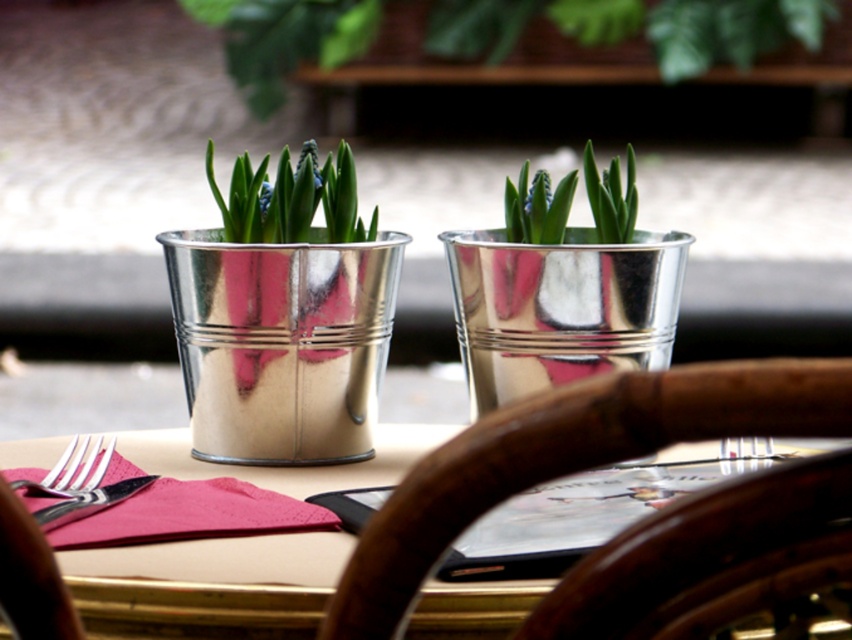
You are a server placing a silver metallic fork at left on the table. You need to place it exactly 10 centimeters away from the metallic silver pot at center. Is the current placement correct?

The metallic silver pot at center and silver metallic fork at left are currently 8.67 centimeters apart, which is less than the required 10 centimeters. The current placement is not correct.

You are sitting at the table and want to reach both points on the table surface. Which point, point (332, 188) or point (50, 472), is closer to you?

Point (332, 188) is further to the camera than point (50, 472), so the point closer to you is point (50, 472).

You are setting up a table for a dinner party and need to place a decorative item between the metallic silver pot at center and the polished silver fork at lower left. Which object should you place closer to the edge of the table to ensure there is enough space?

The polished silver fork at lower left should be placed closer to the edge of the table because the metallic silver pot at center is wider than the polished silver fork at lower left, leaving more space near the fork.